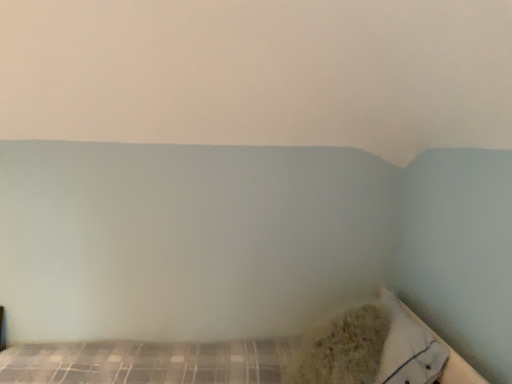
Where is `plaid fabric bed at lower right`? plaid fabric bed at lower right is located at coordinates (148, 362).

The height and width of the screenshot is (384, 512). What do you see at coordinates (148, 362) in the screenshot?
I see `plaid fabric bed at lower right` at bounding box center [148, 362].

From the picture: Measure the distance between point (12, 363) and camera.

Point (12, 363) is 2.05 meters away from camera.

This screenshot has height=384, width=512. Find the location of `plaid fabric bed at lower right`. plaid fabric bed at lower right is located at coordinates 148,362.